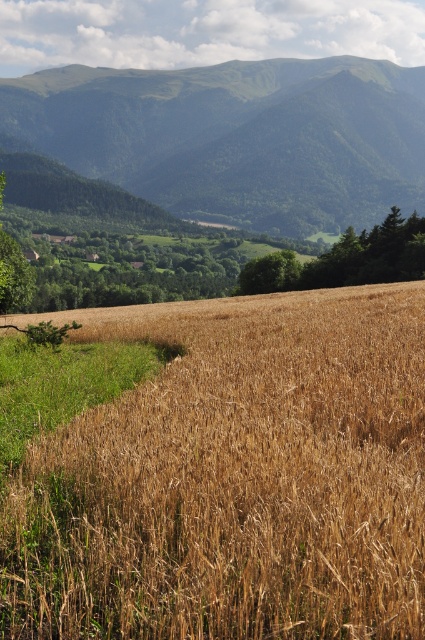
Consider the image. Is green grassy mountain at upper center below green leafy tree at center?

Incorrect, green grassy mountain at upper center is not positioned below green leafy tree at center.

Which is in front, point (217, 156) or point (272, 284)?

Positioned in front is point (272, 284).

Is point (99, 161) less distant than point (254, 288)?

No.

The image size is (425, 640). I want to click on green grassy mountain at upper center, so click(x=238, y=136).

Which is below, brown grainy wheat field at lower left or green grassy mountain at upper center?

brown grainy wheat field at lower left

Is brown grainy wheat field at lower left taller than green grassy mountain at upper center?

Incorrect, brown grainy wheat field at lower left's height is not larger of green grassy mountain at upper center's.

Who is more distant from viewer, (144, 310) or (96, 104)?

The point (96, 104) is behind.

The image size is (425, 640). In order to click on brown grainy wheat field at lower left in this screenshot , I will do coord(234,477).

Measure the distance from brown grainy wheat field at lower left to green leafy tree at center.

The distance of brown grainy wheat field at lower left from green leafy tree at center is 90.12 meters.

Between point (209, 380) and point (246, 291), which one is positioned in front?

Point (209, 380)

The height and width of the screenshot is (640, 425). Identify the location of brown grainy wheat field at lower left. (234, 477).

Where is `brown grainy wheat field at lower left`? brown grainy wheat field at lower left is located at coordinates (234, 477).